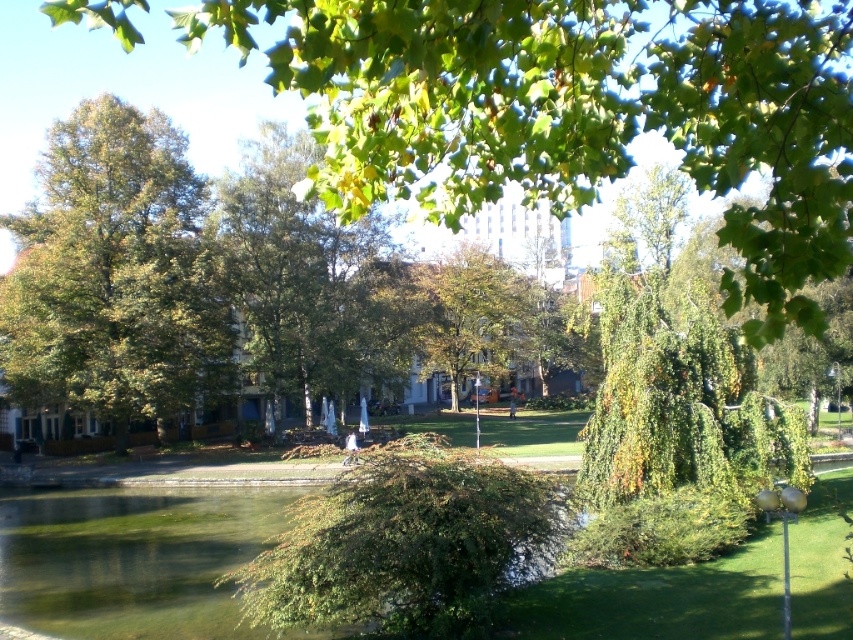
Question: Can you confirm if green leafy tree at upper center is positioned above green translucent water at lower left?

Choices:
 (A) no
 (B) yes

Answer: (B)

Question: Is green leafy tree at upper center bigger than green translucent water at lower left?

Choices:
 (A) yes
 (B) no

Answer: (A)

Question: Among these points, which one is farthest from the camera?

Choices:
 (A) (210, 616)
 (B) (408, 13)
 (C) (83, 404)

Answer: (C)

Question: Where is green leafy tree at upper center located in relation to green translucent water at lower left in the image?

Choices:
 (A) right
 (B) left

Answer: (A)

Question: Based on their relative distances, which object is nearer to the green leafy tree at upper center?

Choices:
 (A) green translucent water at lower left
 (B) green leafy tree at left

Answer: (B)

Question: Which object appears closest to the camera in this image?

Choices:
 (A) green leafy tree at upper center
 (B) green translucent water at lower left
 (C) green leafy tree at left

Answer: (A)